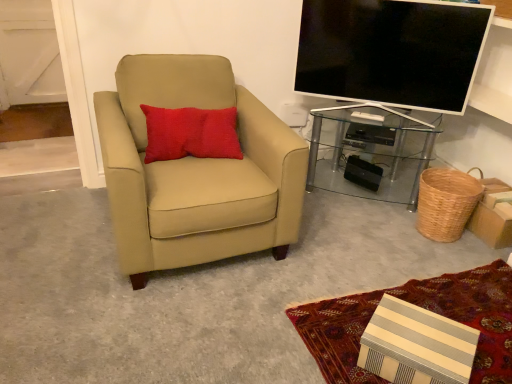
This screenshot has width=512, height=384. In order to click on space that is in front of transparent glass desk at right in this screenshot , I will do (369, 231).